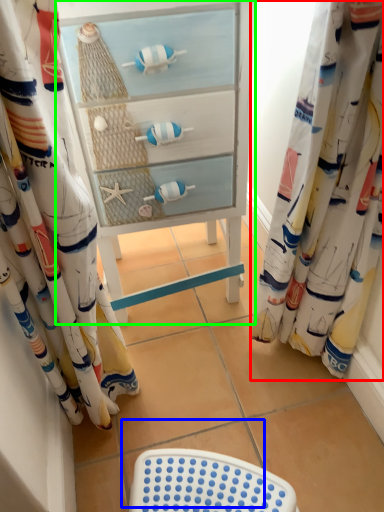
Question: Which is farther away from curtain (highlighted by a red box)? tile (highlighted by a blue box) or furniture (highlighted by a green box)?

Choices:
 (A) tile
 (B) furniture

Answer: (A)